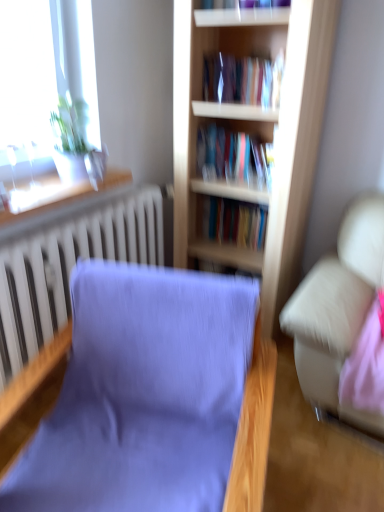
At what (x,y) coordinates should I click in order to perform the action: click on purple fabric chair at center. Please return your answer as a coordinate pair (x, y). This screenshot has width=384, height=512. Looking at the image, I should click on (154, 398).

Locate an element on the screen. light wood bookcase at center is located at coordinates (252, 134).

I want to click on purple fabric chair at center, so click(x=154, y=398).

Is purple fabric chair at center not close to light wood bookcase at center?

No.

Which object is more forward, purple fabric chair at center or light wood bookcase at center?

purple fabric chair at center is closer to the camera.

Between purple fabric chair at center and light wood bookcase at center, which one has more height?

light wood bookcase at center is taller.

Considering the positions of point (34, 478) and point (285, 81), is point (34, 478) closer or farther from the camera than point (285, 81)?

Point (34, 478) appears to be closer to the viewer than point (285, 81).

Does light wood bookcase at center appear on the left side of purple fabric chair at center?

No.

From the image's perspective, is light wood bookcase at center above or below purple fabric chair at center?

From the image's perspective, light wood bookcase at center appears above purple fabric chair at center.

This screenshot has height=512, width=384. Find the location of `window sill located above the purple fabric chair at center (from a real-world perspective)`. window sill located above the purple fabric chair at center (from a real-world perspective) is located at coordinates (54, 193).

Which object is wider, wooden window sill at upper left or purple fabric chair at center?

purple fabric chair at center.

Considering the positions of objects wooden window sill at upper left and purple fabric chair at center in the image provided, who is behind, wooden window sill at upper left or purple fabric chair at center?

Positioned behind is wooden window sill at upper left.

Is white textured radiator at left surrounded by wooden window sill at upper left?

No, white textured radiator at left is not inside wooden window sill at upper left.

Is wooden window sill at upper left wider than white textured radiator at left?

Yes.

Consider the image. Who is smaller, wooden window sill at upper left or white textured radiator at left?

Smaller between the two is wooden window sill at upper left.

Is point (283, 94) more distant than point (154, 242)?

No, it is not.

Can you confirm if light wood bookcase at center is positioned to the right of white textured radiator at left?

Yes, light wood bookcase at center is to the right of white textured radiator at left.

Is light wood bookcase at center placed right next to white textured radiator at left?

No, light wood bookcase at center is not in contact with white textured radiator at left.

Based on their sizes in the image, would you say light wood bookcase at center is bigger or smaller than white textured radiator at left?

Clearly, light wood bookcase at center is larger in size than white textured radiator at left.

Between light wood bookcase at center and wooden window sill at upper left, which one has larger width?

With larger width is light wood bookcase at center.

Is light wood bookcase at center oriented towards wooden window sill at upper left?

No, light wood bookcase at center is not facing towards wooden window sill at upper left.

Between point (221, 258) and point (17, 189), which one is positioned in front?

The point (17, 189) is in front.

Between point (144, 507) and point (32, 264), which one is positioned in front?

The point (144, 507) is closer.

Between purple fabric chair at center and white textured radiator at left, which one has smaller width?

Thinner between the two is white textured radiator at left.

Is purple fabric chair at center aimed at white textured radiator at left?

No, purple fabric chair at center is not turned towards white textured radiator at left.

Identify the location of bookcase on the right side of purple fabric chair at center. This screenshot has height=512, width=384. (252, 134).

The height and width of the screenshot is (512, 384). Identify the location of chair directly beneath the light wood bookcase at center (from a real-world perspective). (154, 398).

From the image, which object appears to be nearer to purple fabric chair at center, wooden window sill at upper left or white textured radiator at left?

white textured radiator at left.

From the image, which object appears to be farther from wooden window sill at upper left, purple fabric chair at center or light wood bookcase at center?

Based on the image, purple fabric chair at center appears to be further to wooden window sill at upper left.

Looking at the image, which one is located closer to light wood bookcase at center, wooden window sill at upper left or white textured radiator at left?

Among the two, white textured radiator at left is located nearer to light wood bookcase at center.

Estimate the real-world distances between objects in this image. Which object is closer to white textured radiator at left, purple fabric chair at center or wooden window sill at upper left?

wooden window sill at upper left is positioned closer to the anchor white textured radiator at left.

Which object lies further to the anchor point purple fabric chair at center, light wood bookcase at center or wooden window sill at upper left?

Among the two, light wood bookcase at center is located further to purple fabric chair at center.

In the scene shown: Based on their spatial positions, is wooden window sill at upper left or purple fabric chair at center further from light wood bookcase at center?

purple fabric chair at center lies further to light wood bookcase at center than the other object.

Looking at this image, based on their spatial positions, is purple fabric chair at center or white textured radiator at left closer to light wood bookcase at center?

white textured radiator at left is closer to light wood bookcase at center.

When comparing their distances from light wood bookcase at center, does white textured radiator at left or wooden window sill at upper left seem further?

wooden window sill at upper left is positioned further to the anchor light wood bookcase at center.

This screenshot has width=384, height=512. Find the location of `radiator located between purple fabric chair at center and wooden window sill at upper left in the depth direction`. radiator located between purple fabric chair at center and wooden window sill at upper left in the depth direction is located at coordinates (69, 266).

In order to click on window sill that lies between light wood bookcase at center and purple fabric chair at center from top to bottom in this screenshot , I will do `click(54, 193)`.

Locate an element on the screen. The image size is (384, 512). radiator between purple fabric chair at center and light wood bookcase at center along the z-axis is located at coordinates [x=69, y=266].

Where is `radiator located between wooden window sill at upper left and light wood bookcase at center in the left-right direction`? Image resolution: width=384 pixels, height=512 pixels. radiator located between wooden window sill at upper left and light wood bookcase at center in the left-right direction is located at coordinates (69, 266).